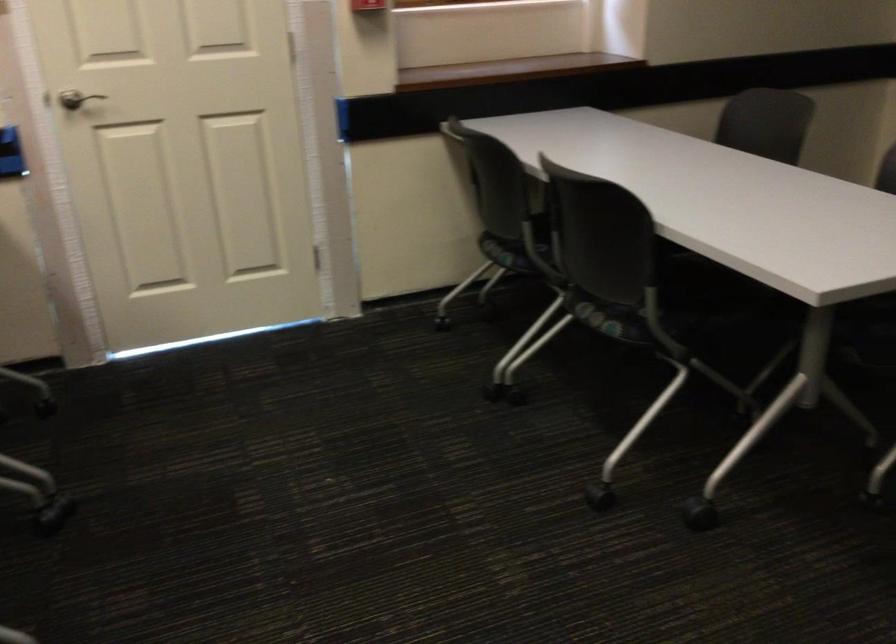
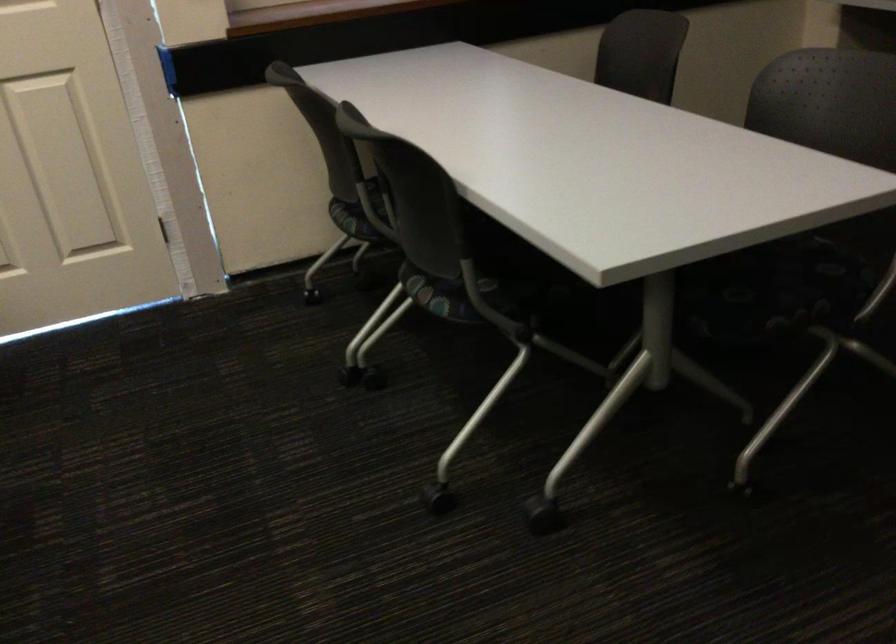
In a continuous first-person perspective shot, in which direction is the camera moving?

The movement direction of the cameraman is right, forward.